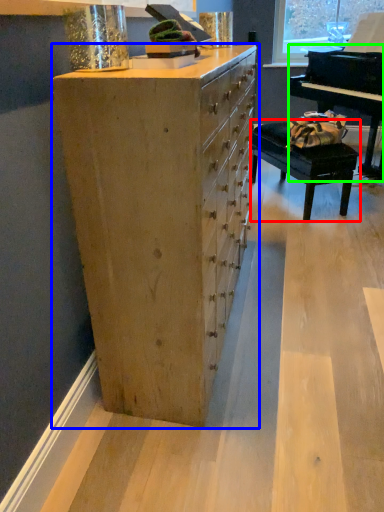
Question: Based on their relative distances, which object is nearer to table (highlighted by a red box)? Choose from chest of drawers (highlighted by a blue box) and piano (highlighted by a green box).

Choices:
 (A) chest of drawers
 (B) piano

Answer: (B)